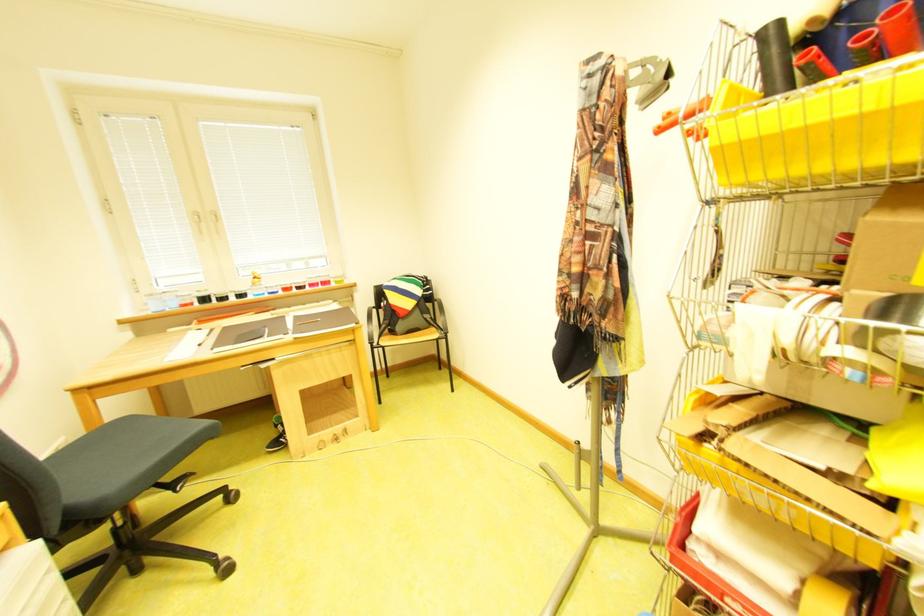
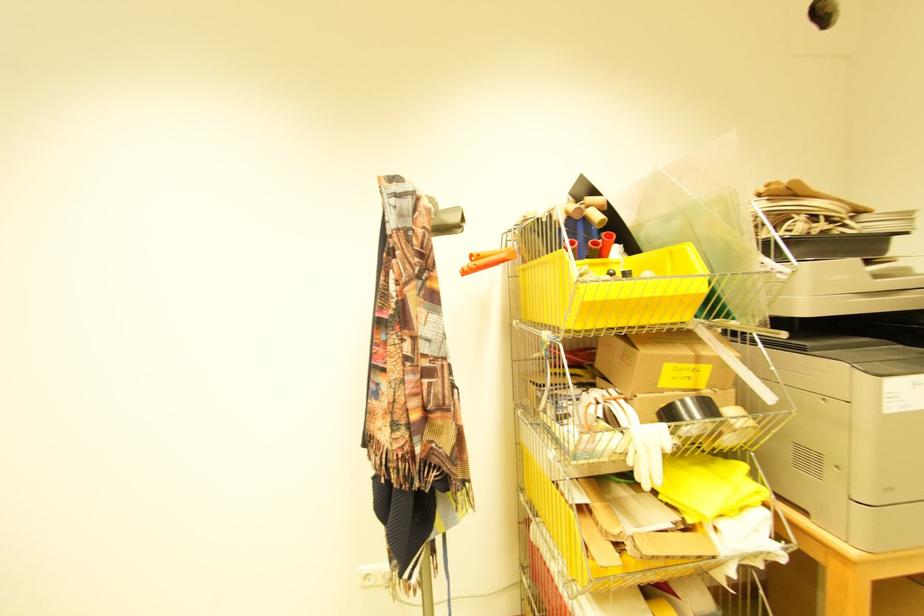
The point at (687, 111) is marked in the first image. Where is the corresponding point in the second image?

(492, 254)